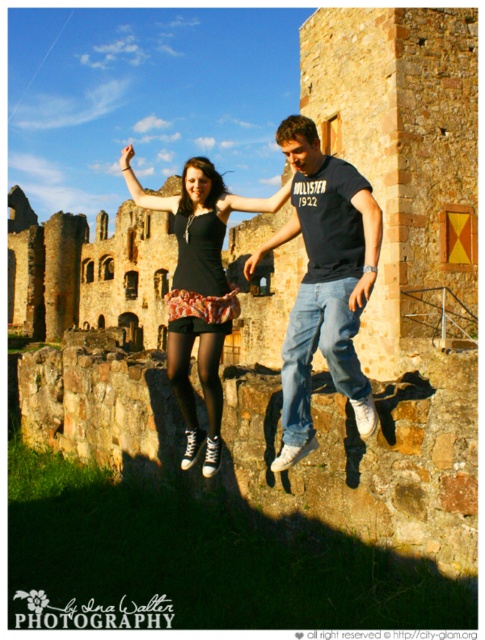
Question: Which point is farther to the camera?

Choices:
 (A) (209, 248)
 (B) (321, 156)

Answer: (A)

Question: Can you confirm if matte black t-shirt at center is positioned above matte black dress at center?

Choices:
 (A) yes
 (B) no

Answer: (A)

Question: Among these points, which one is nearest to the camera?

Choices:
 (A) (361, 221)
 (B) (206, 336)

Answer: (A)

Question: Does matte black t-shirt at center appear on the right side of matte black dress at center?

Choices:
 (A) no
 (B) yes

Answer: (B)

Question: Is matte black t-shirt at center further to camera compared to matte black dress at center?

Choices:
 (A) no
 (B) yes

Answer: (A)